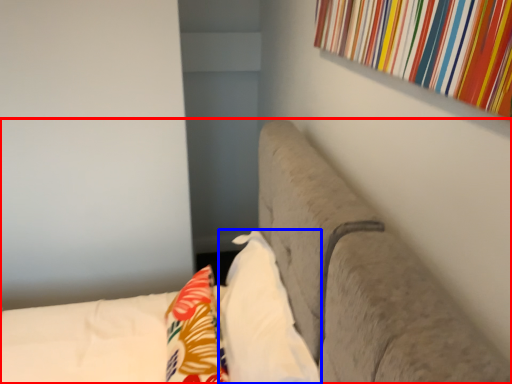
Question: Which of the following is the closest to the observer, furniture (highlighted by a red box) or pillow (highlighted by a blue box)?

Choices:
 (A) furniture
 (B) pillow

Answer: (A)